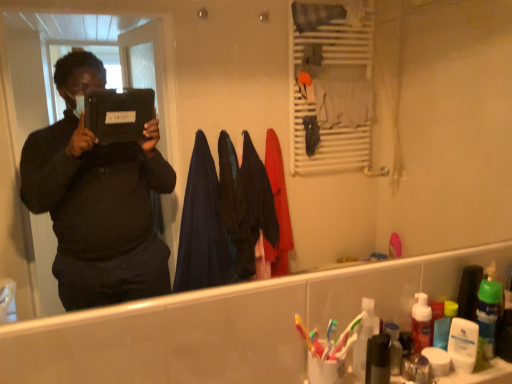
Question: From a real-world perspective, is metallic silver soap dispenser at lower right, positioned as the second toiletry in right-to-left order, under translucent plastic toothbrushes at lower right, arranged as the 3th toiletry when viewed from the right?

Choices:
 (A) no
 (B) yes

Answer: (B)

Question: Is metallic silver soap dispenser at lower right, which is counted as the 2th toiletry, starting from the left, shorter than translucent plastic toothbrushes at lower right, arranged as the 3th toiletry when viewed from the right?

Choices:
 (A) no
 (B) yes

Answer: (B)

Question: Is metallic silver soap dispenser at lower right, which is counted as the 2th toiletry, starting from the left, placed right next to translucent plastic toothbrushes at lower right, which is the first toiletry from left to right?

Choices:
 (A) yes
 (B) no

Answer: (B)

Question: Is metallic silver soap dispenser at lower right, which is counted as the 2th toiletry, starting from the left, looking in the opposite direction of translucent plastic toothbrushes at lower right, arranged as the 3th toiletry when viewed from the right?

Choices:
 (A) no
 (B) yes

Answer: (A)

Question: Are metallic silver soap dispenser at lower right, which is counted as the 2th toiletry, starting from the left, and translucent plastic toothbrushes at lower right, which is the first toiletry from left to right, located far from each other?

Choices:
 (A) no
 (B) yes

Answer: (A)

Question: Considering the relative sizes of metallic silver soap dispenser at lower right, which is counted as the 2th toiletry, starting from the left, and translucent plastic toothbrushes at lower right, arranged as the 3th toiletry when viewed from the right, in the image provided, is metallic silver soap dispenser at lower right, which is counted as the 2th toiletry, starting from the left, taller than translucent plastic toothbrushes at lower right, arranged as the 3th toiletry when viewed from the right,?

Choices:
 (A) no
 (B) yes

Answer: (A)

Question: Does white matte lotion at lower right, arranged as the third toiletry when viewed from the left, turn towards translucent plastic toothbrushes at lower right, arranged as the 3th toiletry when viewed from the right?

Choices:
 (A) no
 (B) yes

Answer: (A)

Question: Does white matte lotion at lower right, arranged as the third toiletry when viewed from the left, come behind translucent plastic toothbrushes at lower right, which is the first toiletry from left to right?

Choices:
 (A) yes
 (B) no

Answer: (A)

Question: Is white matte lotion at lower right, which is the first toiletry in right-to-left order, facing away from translucent plastic toothbrushes at lower right, arranged as the 3th toiletry when viewed from the right?

Choices:
 (A) no
 (B) yes

Answer: (A)

Question: Is white matte lotion at lower right, arranged as the third toiletry when viewed from the left, far away from translucent plastic toothbrushes at lower right, which is the first toiletry from left to right?

Choices:
 (A) no
 (B) yes

Answer: (A)

Question: Does white matte lotion at lower right, which is the first toiletry in right-to-left order, have a greater height compared to translucent plastic toothbrushes at lower right, which is the first toiletry from left to right?

Choices:
 (A) no
 (B) yes

Answer: (A)

Question: Is white matte lotion at lower right, arranged as the third toiletry when viewed from the left, thinner than translucent plastic toothbrushes at lower right, which is the first toiletry from left to right?

Choices:
 (A) no
 (B) yes

Answer: (B)

Question: Would you say translucent plastic toothbrushes at lower right, which is the first toiletry from left to right, is a long distance from white matte lotion at lower right, which is the first toiletry in right-to-left order?

Choices:
 (A) no
 (B) yes

Answer: (A)